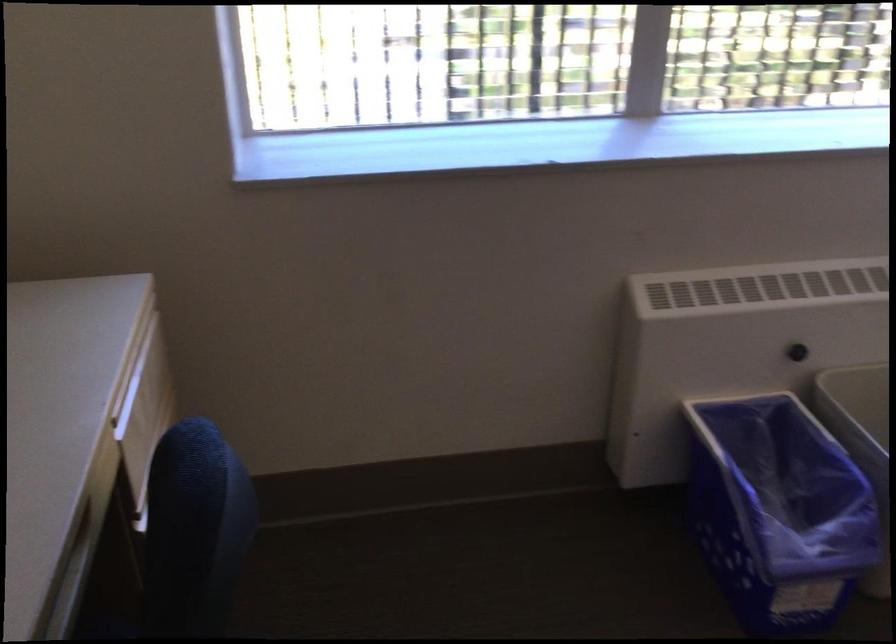
Describe the element at coordinates (796, 352) in the screenshot. I see `the black heater knob` at that location.